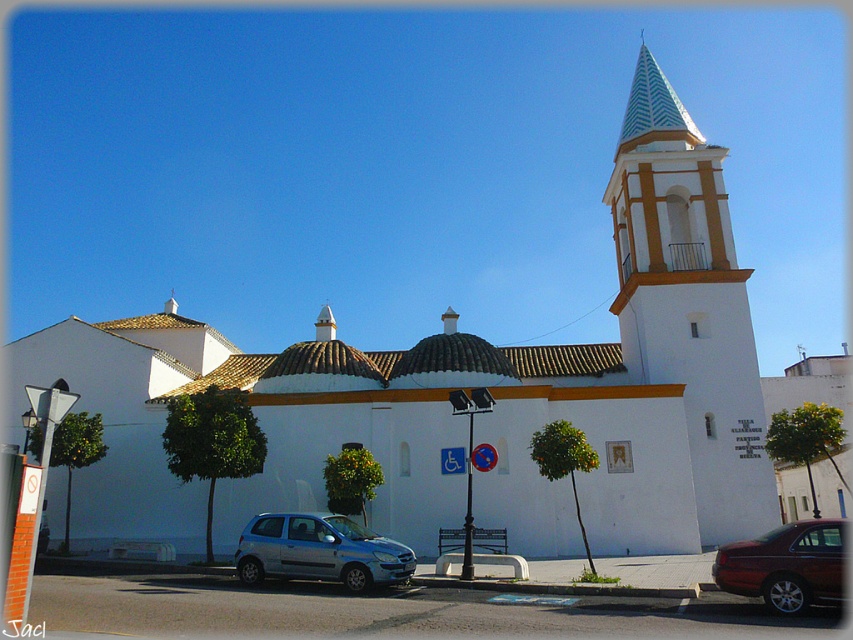
In the scene shown: You are a delivery person who needs to park your vehicle in a spot that is exactly as wide as your truck, which is the same width as the shiny dark red sedan at lower right. Given the space next to the satin silver hatchback at lower center, can you fit your truck there without overlapping?

The satin silver hatchback at lower center is wider than the shiny dark red sedan at lower right. Since your truck is the same width as the sedan, the space next to the hatchback is wider than needed, so you can fit your truck there without overlapping.

You are a pedestrian standing at the entrance of the white church and want to cross the parking lot to reach the trees on the other side. There are two cars in your path. Can you walk between the satin silver hatchback at lower center and the shiny dark red sedan at lower right?

The shiny dark red sedan at lower right is behind the satin silver hatchback at lower center, so you cannot walk between them as the sedan is not in front of the hatchback. You would need to go around both cars to reach the trees.

You are standing in front of the white church with a bell tower. There is a point marked at coordinates (689, 301). Based on the scene description, can you determine what architectural feature this point is located on?

The point at coordinates (689, 301) is located on the white painted stucco bell tower at upper right.